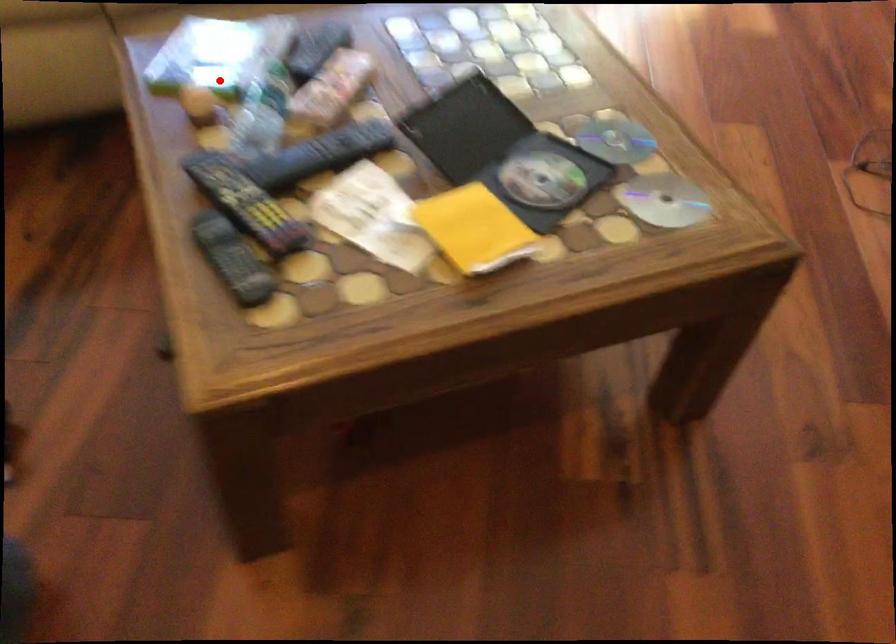
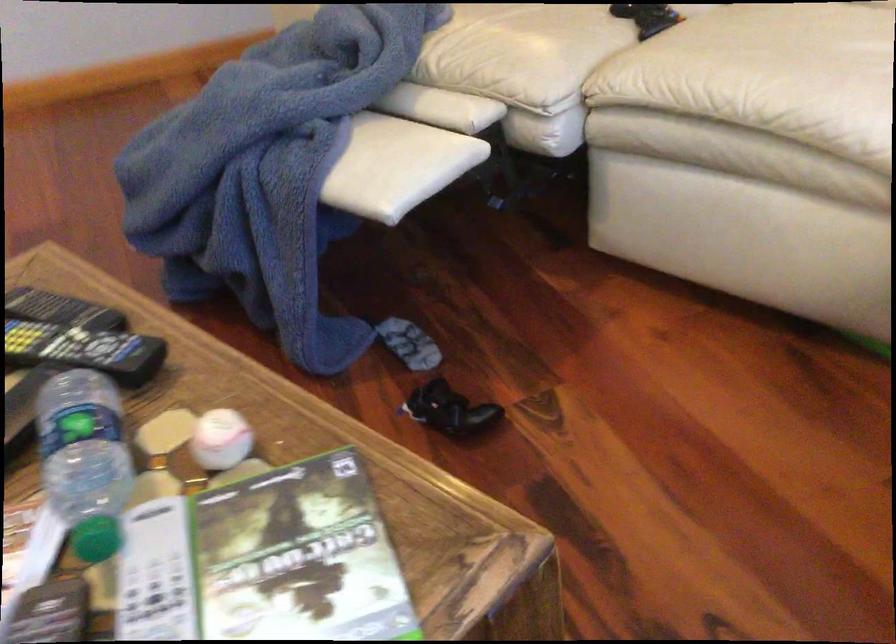
Where in the second image is the point corresponding to the highlighted location from the first image?

(220, 439)